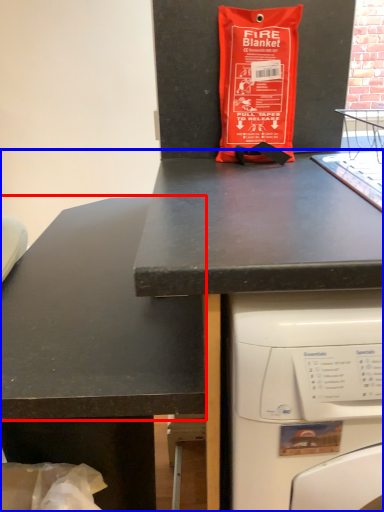
Question: Which of the following is the farthest to the observer, counter top (highlighted by a red box) or desk (highlighted by a blue box)?

Choices:
 (A) counter top
 (B) desk

Answer: (A)